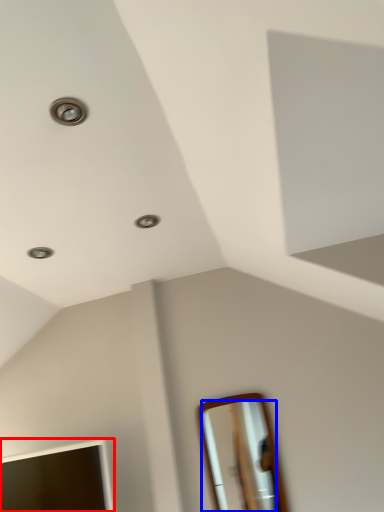
Question: Among these objects, which one is farthest to the camera, mirror (highlighted by a red box) or mirror (highlighted by a blue box)?

Choices:
 (A) mirror
 (B) mirror

Answer: (B)